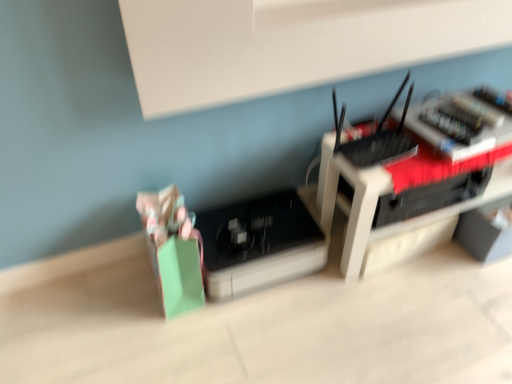
Question: Should I look upward or downward to see black plastic router at center?

Choices:
 (A) up
 (B) down

Answer: (A)

Question: Is black plastic register at center, which ranks as the second register in front-to-back order, not within black plastic router at upper right, positioned as the 2th register in back-to-front order?

Choices:
 (A) no
 (B) yes

Answer: (B)

Question: Considering the relative positions of black plastic register at center, the first register positioned from the left, and black plastic router at upper right, positioned as the first register in front-to-back order, in the image provided, is black plastic register at center, the first register positioned from the left, to the left of black plastic router at upper right, positioned as the first register in front-to-back order, from the viewer's perspective?

Choices:
 (A) no
 (B) yes

Answer: (B)

Question: Does black plastic register at center, placed as the second register when sorted from right to left, lie behind black plastic router at upper right, the 1th register when ordered from top to bottom?

Choices:
 (A) yes
 (B) no

Answer: (A)

Question: Considering the relative sizes of black plastic register at center, the first register positioned from the left, and black plastic router at upper right, placed as the 2th register when sorted from left to right, in the image provided, is black plastic register at center, the first register positioned from the left, thinner than black plastic router at upper right, placed as the 2th register when sorted from left to right,?

Choices:
 (A) no
 (B) yes

Answer: (A)

Question: Does black plastic register at center, which ranks as the second register in front-to-back order, have a smaller size compared to black plastic router at upper right, which ranks as the 2th register in bottom-to-top order?

Choices:
 (A) yes
 (B) no

Answer: (B)

Question: Is black plastic register at center, marked as the first register in a bottom-to-top arrangement, not close to black plastic router at upper right, the first register viewed from the right?

Choices:
 (A) no
 (B) yes

Answer: (A)

Question: Is black plastic register at center, placed as the second register when sorted from right to left, further to camera compared to black plastic router at center?

Choices:
 (A) yes
 (B) no

Answer: (A)

Question: From a real-world perspective, is black plastic register at center, marked as the first register in a bottom-to-top arrangement, under black plastic router at center?

Choices:
 (A) yes
 (B) no

Answer: (A)

Question: Considering the relative sizes of black plastic register at center, marked as the first register in a bottom-to-top arrangement, and black plastic router at center in the image provided, is black plastic register at center, marked as the first register in a bottom-to-top arrangement, smaller than black plastic router at center?

Choices:
 (A) no
 (B) yes

Answer: (B)

Question: Can you confirm if black plastic register at center, placed as the second register when sorted from right to left, is thinner than black plastic router at center?

Choices:
 (A) no
 (B) yes

Answer: (A)

Question: Could you tell me if black plastic register at center, placed as the second register when sorted from right to left, is turned towards black plastic router at center?

Choices:
 (A) yes
 (B) no

Answer: (B)

Question: From a real-world perspective, is black plastic register at center, placed as the second register when sorted from right to left, on black plastic router at center?

Choices:
 (A) no
 (B) yes

Answer: (A)

Question: Is black plastic router at center positioned with its back to black plastic router at upper right, the first register viewed from the right?

Choices:
 (A) yes
 (B) no

Answer: (B)